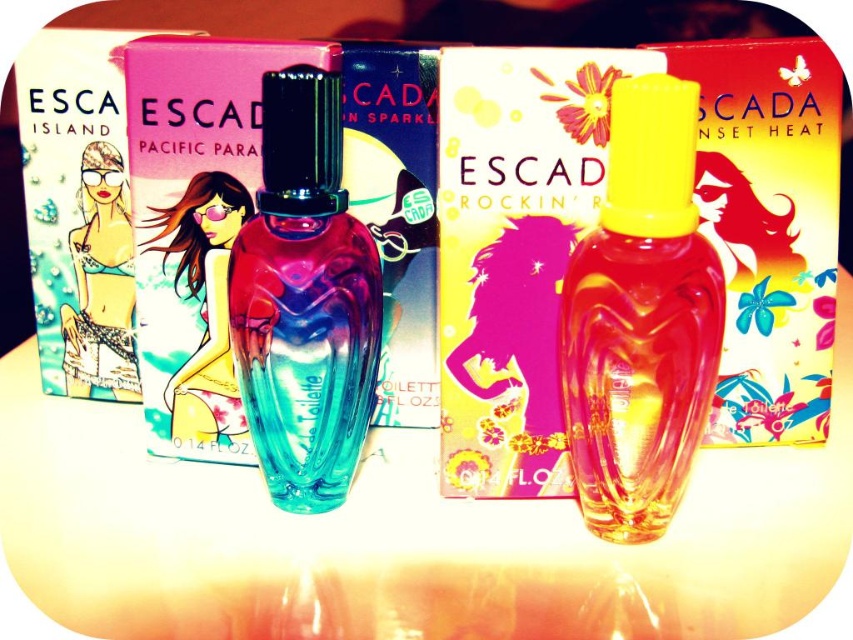
Based on the photo, does transparent glass perfume bottles at center appear over translucent yellow glass perfume at center?

No, transparent glass perfume bottles at center is not above translucent yellow glass perfume at center.

Is transparent glass perfume bottles at center taller than translucent yellow glass perfume at center?

No, transparent glass perfume bottles at center is not taller than translucent yellow glass perfume at center.

Which is in front, point (404, 513) or point (642, 401)?

Point (642, 401)

Locate an element on the screen. The height and width of the screenshot is (640, 853). transparent glass perfume bottles at center is located at coordinates (401, 538).

What do you see at coordinates (305, 300) in the screenshot? This screenshot has height=640, width=853. I see `translucent glass perfume at center` at bounding box center [305, 300].

Between translucent glass perfume at center and matte silver bikini at center, which one has more height?

With more height is translucent glass perfume at center.

Describe the element at coordinates (305, 300) in the screenshot. I see `translucent glass perfume at center` at that location.

The width and height of the screenshot is (853, 640). What are the coordinates of `translucent glass perfume at center` in the screenshot? It's located at (305, 300).

Can you confirm if transparent glass perfume bottles at center is bigger than translucent glass perfume at center?

Yes, transparent glass perfume bottles at center is bigger than translucent glass perfume at center.

The height and width of the screenshot is (640, 853). I want to click on transparent glass perfume bottles at center, so click(x=401, y=538).